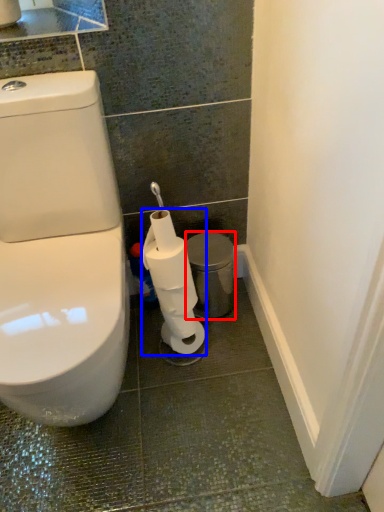
Question: Which object is further to the camera taking this photo, porcelain (highlighted by a red box) or toilet paper (highlighted by a blue box)?

Choices:
 (A) porcelain
 (B) toilet paper

Answer: (A)